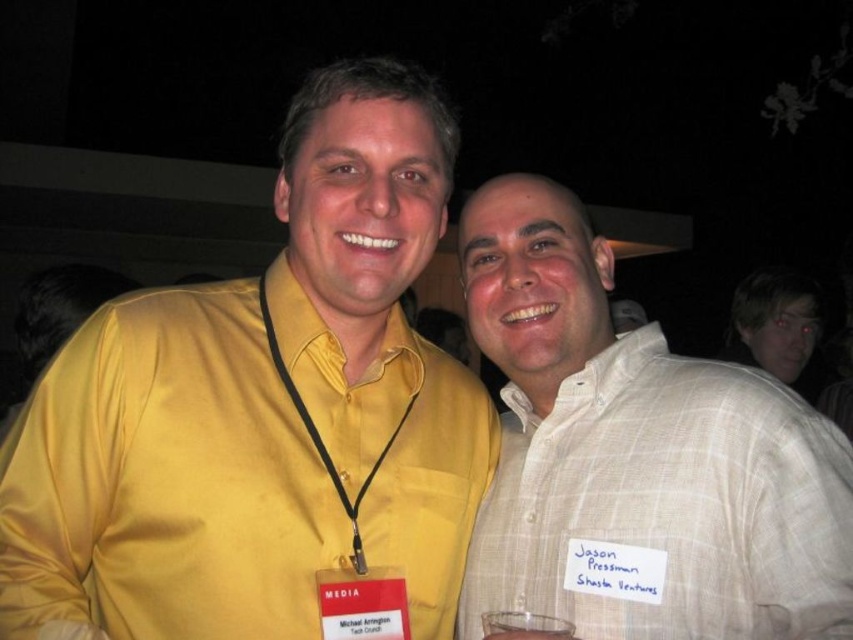
Question: Does white checkered shirt at right have a greater width compared to clear glass at lower center?

Choices:
 (A) yes
 (B) no

Answer: (A)

Question: Is yellow satin shirt at center below clear glass at lower center?

Choices:
 (A) yes
 (B) no

Answer: (B)

Question: Estimate the real-world distances between objects in this image. Which object is closer to the white checkered shirt at right?

Choices:
 (A) light brown plaid shirt at right
 (B) clear glass at lower center
 (C) yellow satin shirt at center

Answer: (C)

Question: Does light brown plaid shirt at right appear over clear glass at lower center?

Choices:
 (A) yes
 (B) no

Answer: (A)

Question: Which is nearer to the white checkered shirt at right?

Choices:
 (A) yellow satin shirt at center
 (B) clear glass at lower center
 (C) light brown plaid shirt at right

Answer: (A)

Question: Which of the following is the farthest from the observer?

Choices:
 (A) yellow satin shirt at center
 (B) white checkered shirt at right
 (C) clear glass at lower center
 (D) light brown plaid shirt at right

Answer: (D)